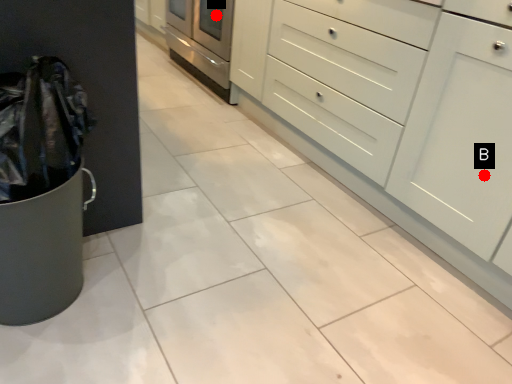
Question: Two points are circled on the image, labeled by A and B beside each circle. Which point is closer to the camera?

Choices:
 (A) A is closer
 (B) B is closer

Answer: (B)